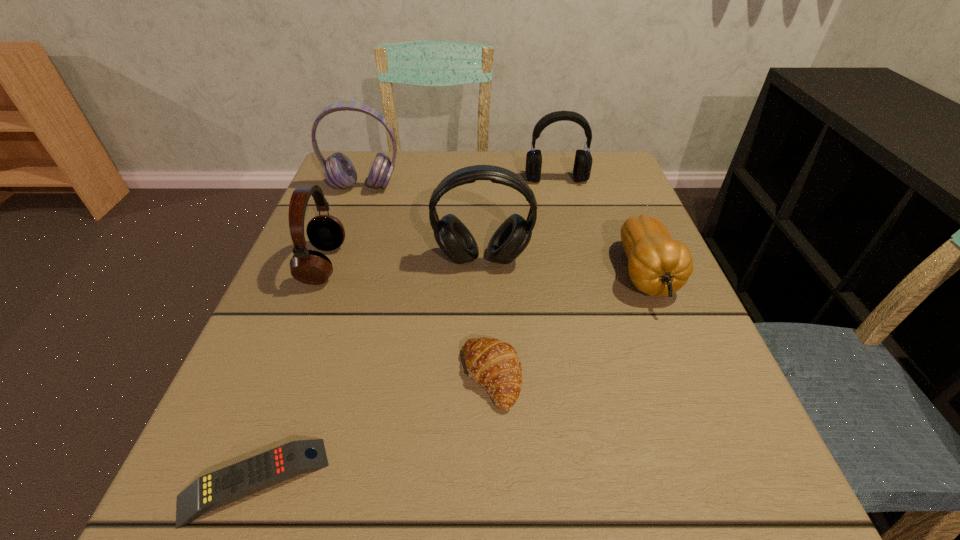
Image resolution: width=960 pixels, height=540 pixels. I want to click on free region located on the left of the sixth farthest object, so click(x=360, y=377).

The width and height of the screenshot is (960, 540). What are the coordinates of `vacant space located on the right of the nearest object` in the screenshot? It's located at (551, 481).

You are a GUI agent. You are given a task and a screenshot of the screen. Output one action in this format:
    pyautogui.click(x=<x>, y=<y>)
    Task: Click on the object located at the near edge
    The width and height of the screenshot is (960, 540).
    Given the screenshot: What is the action you would take?
    pyautogui.click(x=224, y=486)

Where is `remote control at the left edge`? remote control at the left edge is located at coordinates (224, 486).

The width and height of the screenshot is (960, 540). Identify the location of headset that is at the right edge. (582, 167).

This screenshot has width=960, height=540. Find the location of `gourd that is at the right edge`. gourd that is at the right edge is located at coordinates (658, 265).

Identify the location of object that is at the far left corner. (339, 171).

Locate an element on the screen. The height and width of the screenshot is (540, 960). object present at the near left corner is located at coordinates (224, 486).

Where is `object at the far right corner`? Image resolution: width=960 pixels, height=540 pixels. object at the far right corner is located at coordinates (582, 167).

In the image, there is a desktop. At what (x,y) coordinates should I click in order to perform the action: click on vacant space at the far edge. Please return your answer as a coordinate pair (x, y). Looking at the image, I should click on (414, 189).